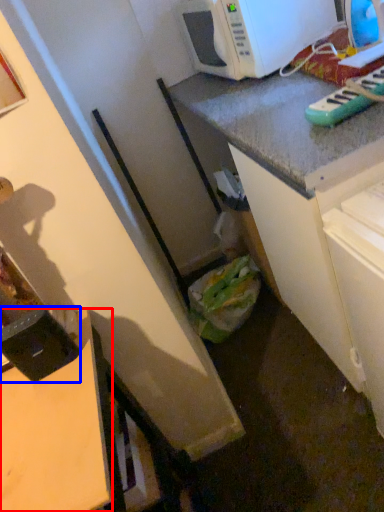
Question: Which object appears closest to the camera in this image, desk (highlighted by a red box) or appliance (highlighted by a blue box)?

Choices:
 (A) desk
 (B) appliance

Answer: (A)